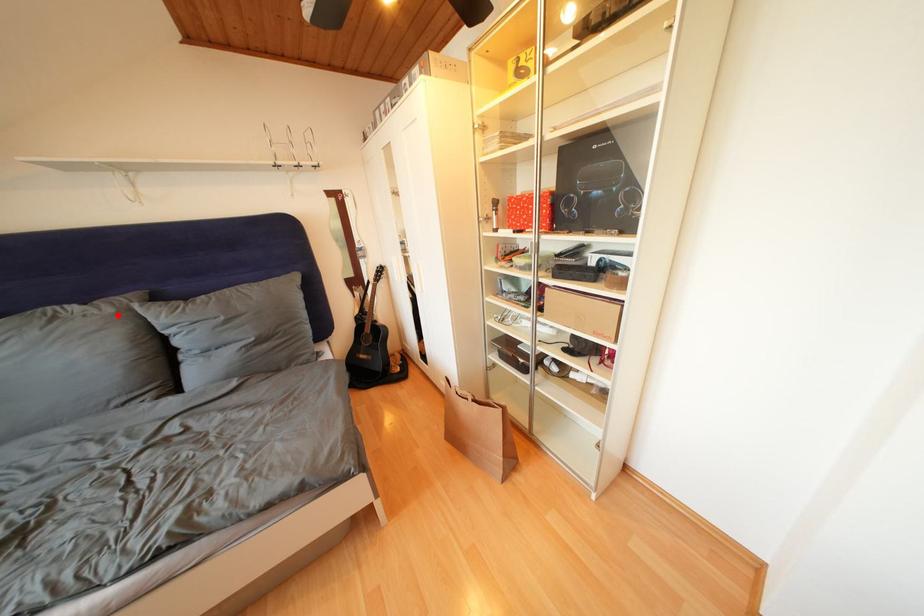
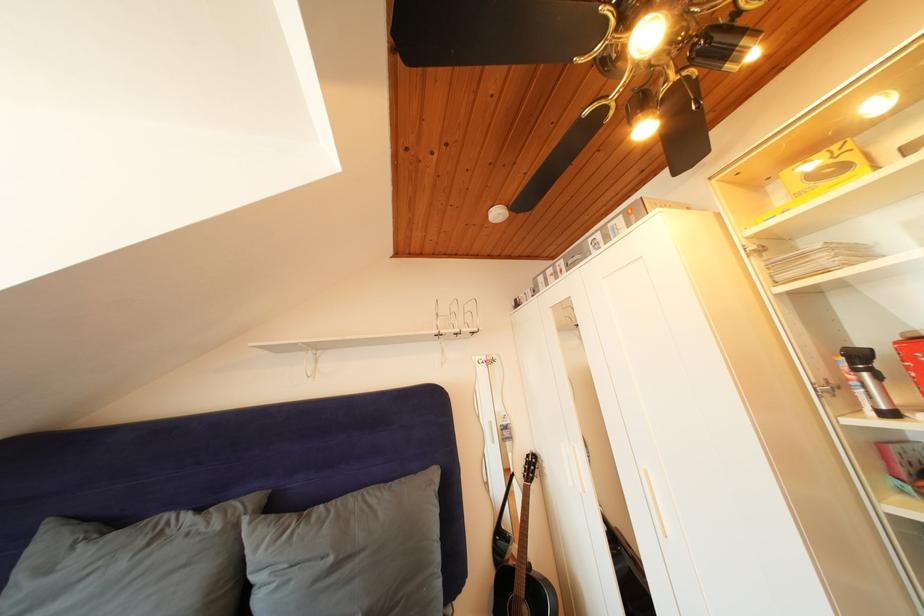
Locate, in the second image, the point that corresponds to the highlighted location in the first image.

(225, 531)